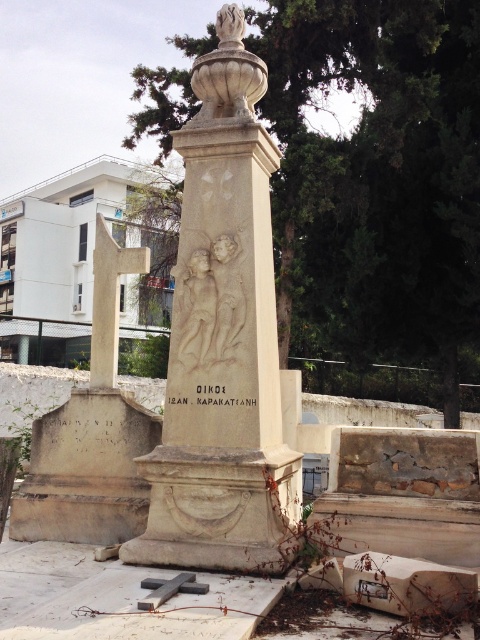
Question: Which object is positioned closest to the matte stone statue at center?

Choices:
 (A) beige stone monument at center
 (B) white stone relief at center

Answer: (B)

Question: Is beige stone monument at center above matte stone statue at center?

Choices:
 (A) yes
 (B) no

Answer: (A)

Question: Among these objects, which one is farthest from the camera?

Choices:
 (A) matte stone statue at center
 (B) beige stone monument at center
 (C) white stone relief at center

Answer: (A)

Question: Can you confirm if beige stone monument at center is bigger than white stone relief at center?

Choices:
 (A) yes
 (B) no

Answer: (A)

Question: Can you confirm if white stone relief at center is thinner than matte stone statue at center?

Choices:
 (A) no
 (B) yes

Answer: (B)

Question: Which object appears farthest from the camera in this image?

Choices:
 (A) beige stone monument at center
 (B) matte stone statue at center

Answer: (B)